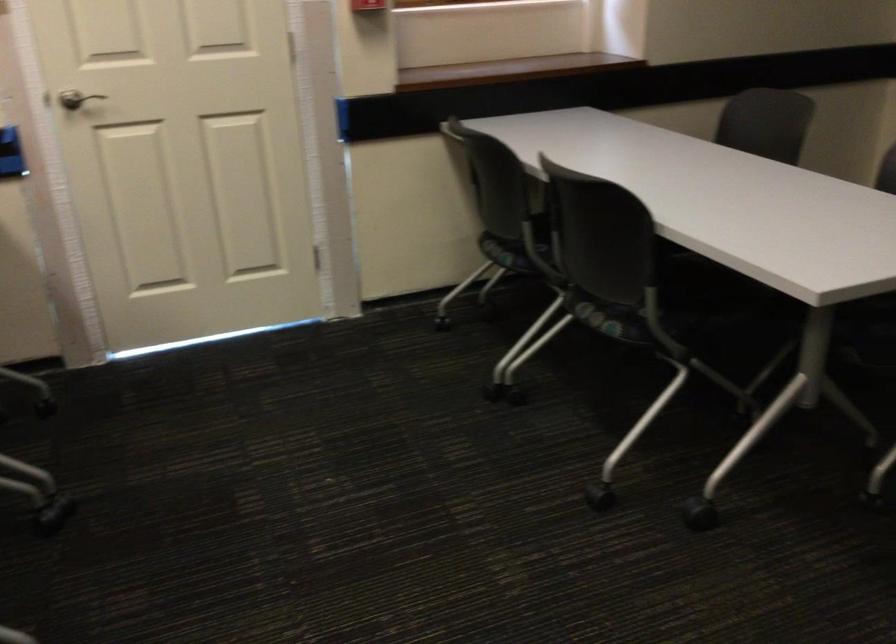
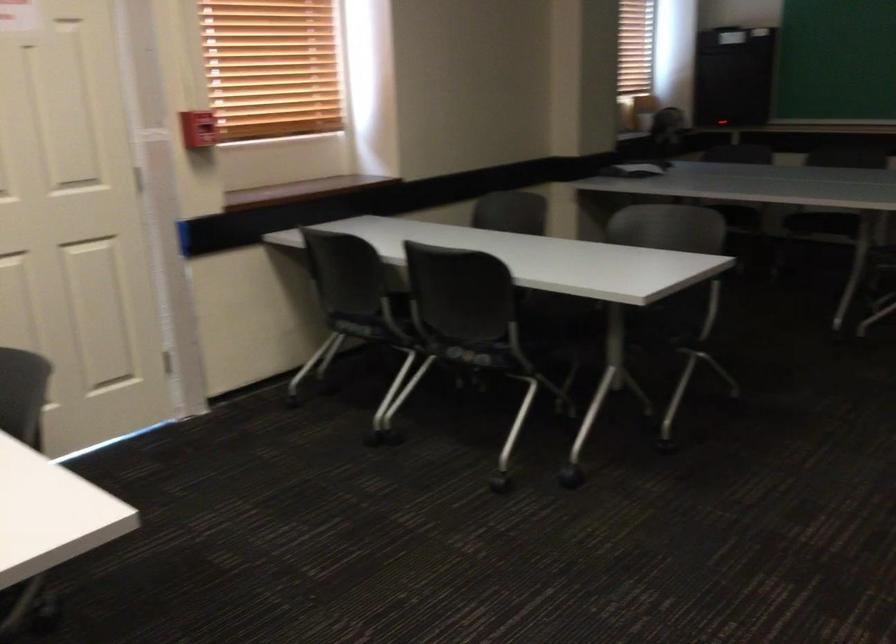
The point at (607, 317) is marked in the first image. Where is the corresponding point in the second image?

(474, 354)